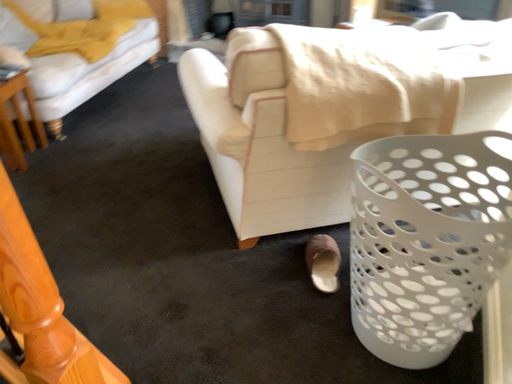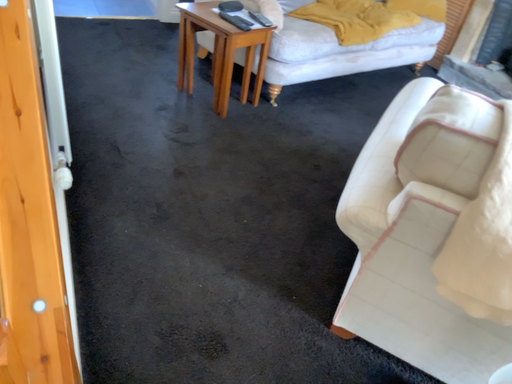
Question: Which way did the camera rotate in the video?

Choices:
 (A) rotated upward
 (B) rotated downward

Answer: (A)